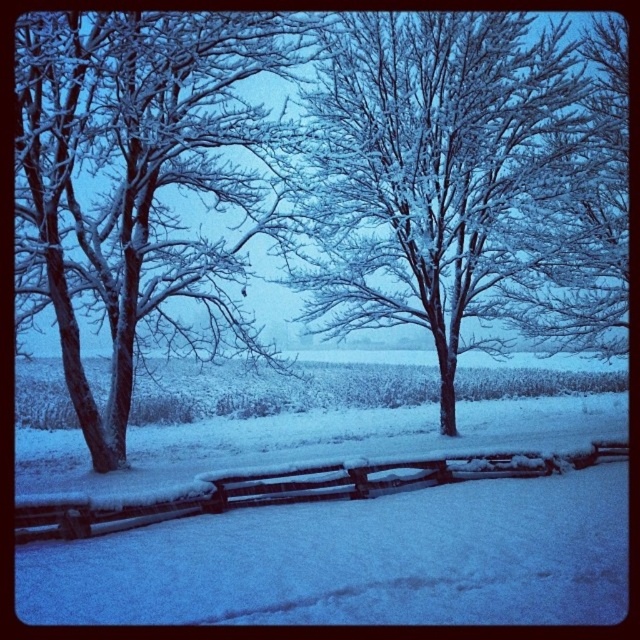
Question: Which object is positioned farthest from the snow-covered branches at left?

Choices:
 (A) snow-covered wooden fence at center
 (B) snow-covered branches at center

Answer: (A)

Question: Is snow-covered branches at center above snow-covered wooden fence at center?

Choices:
 (A) yes
 (B) no

Answer: (A)

Question: Is snow-covered branches at left below snow-covered wooden fence at center?

Choices:
 (A) no
 (B) yes

Answer: (A)

Question: Based on their relative distances, which object is farther from the snow-covered branches at center?

Choices:
 (A) snow-covered branches at left
 (B) snow-covered wooden fence at center

Answer: (B)

Question: Is snow-covered branches at center to the right of snow-covered wooden fence at center from the viewer's perspective?

Choices:
 (A) no
 (B) yes

Answer: (B)

Question: Among these objects, which one is farthest from the camera?

Choices:
 (A) snow-covered branches at center
 (B) snow-covered branches at left
 (C) snow-covered wooden fence at center

Answer: (A)